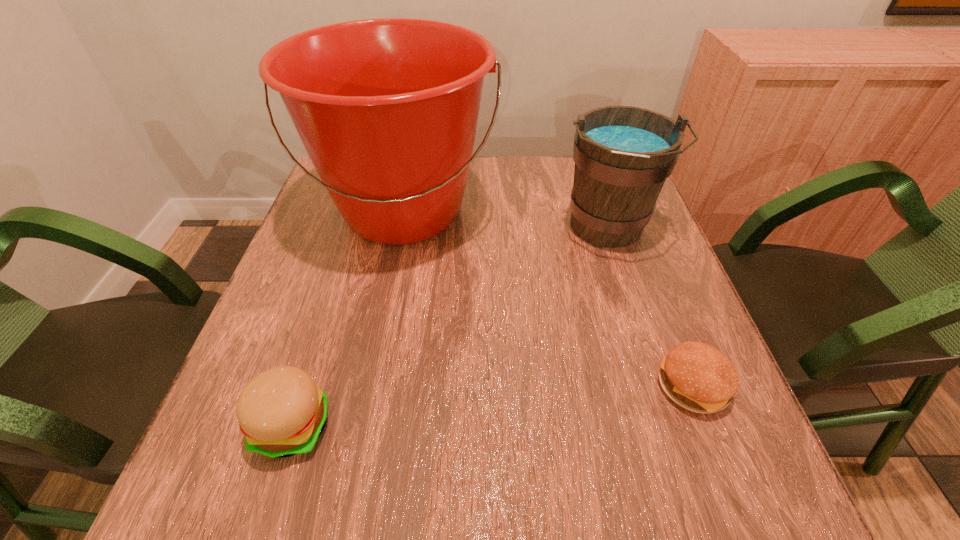
In the image, there is a desktop. Where is `free space at the far edge`? The height and width of the screenshot is (540, 960). free space at the far edge is located at coordinates (543, 186).

Identify the location of free space at the left edge of the desktop. The height and width of the screenshot is (540, 960). (276, 294).

The height and width of the screenshot is (540, 960). What are the coordinates of `vacant space at the right edge` in the screenshot? It's located at (637, 282).

Locate an element on the screen. free space that is in between the tallest object and the right hamburger is located at coordinates (548, 299).

Locate an element on the screen. The height and width of the screenshot is (540, 960). vacant point located between the shortest object and the tallest object is located at coordinates (548, 299).

At what (x,y) coordinates should I click in order to perform the action: click on unoccupied area between the wine bucket and the shortest object. Please return your answer as a coordinate pair (x, y). Looking at the image, I should click on point(650,307).

Identify the location of vacant area between the wine bucket and the bucket. This screenshot has width=960, height=540. (505, 220).

The height and width of the screenshot is (540, 960). I want to click on vacant point located between the bucket and the third tallest object, so click(x=348, y=319).

Where is `free space between the wine bucket and the taller hamburger`? The height and width of the screenshot is (540, 960). free space between the wine bucket and the taller hamburger is located at coordinates (450, 327).

The height and width of the screenshot is (540, 960). I want to click on empty space between the shorter hamburger and the second shortest object, so click(x=492, y=406).